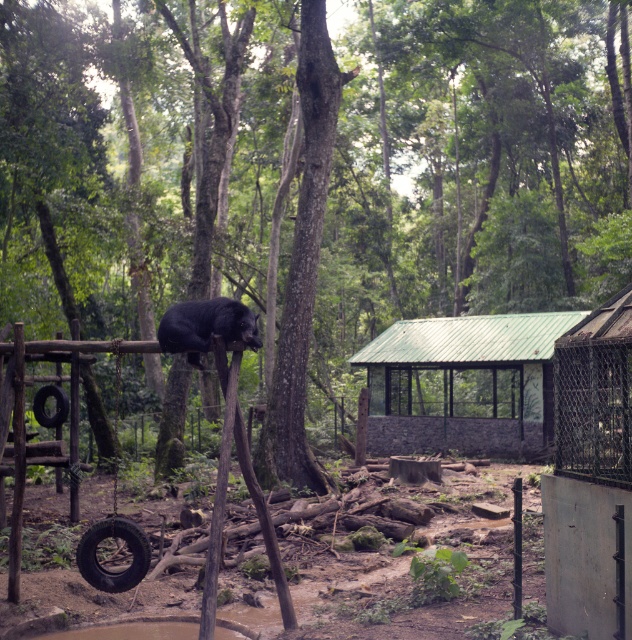
You are a zookeeper who needs to ensure safety for visitors. You observe the black rubber tire swing at lower left and the black rubber tire at center in the animal play area. Which object is more likely to be a potential hazard if a visitor accidentally steps on it?

The black rubber tire swing at lower left is larger in size compared to the black rubber tire at center, making it a more likely potential hazard if a visitor accidentally steps on it due to its greater size and possible instability.

You are a park ranger checking the forest area. You see the rough bark tree at center and the black rubber tire at center. Which object is larger?

The black rubber tire at center is larger than the rough bark tree at center.

Based on the scene description, can you determine the relative positions of the black fur bear at center and the black rubber tire at center? Specifically, is the bear positioned to the left or right of the tire?

The black fur bear at center is to the right of the black rubber tire at center.